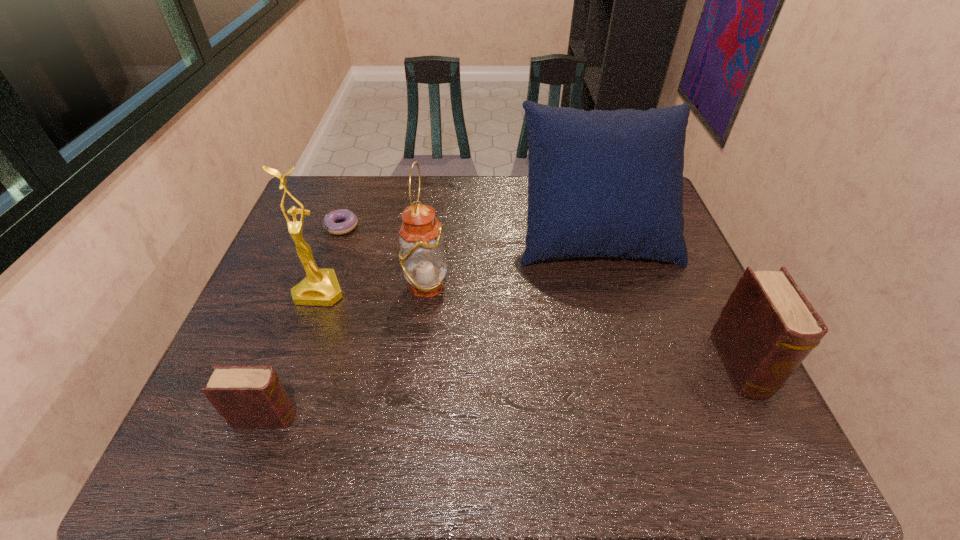
Find the location of a particular element. vacant area that lies between the left diary and the fifth farthest object is located at coordinates (504, 392).

Locate an element on the screen. The height and width of the screenshot is (540, 960). free spot between the shortest object and the shorter diary is located at coordinates (x=304, y=322).

Find the location of a particular element. This screenshot has width=960, height=540. free space between the oil lamp and the shortest object is located at coordinates [384, 255].

Where is `vacant space that's between the nearest object and the third shortest object`? The image size is (960, 540). vacant space that's between the nearest object and the third shortest object is located at coordinates (504, 392).

Locate an element on the screen. blank region between the cushion and the farther diary is located at coordinates (668, 299).

The height and width of the screenshot is (540, 960). Find the location of `vacant space that is in between the second nearest object and the shortest object`. vacant space that is in between the second nearest object and the shortest object is located at coordinates (541, 296).

Locate an element on the screen. free spot between the award and the fourth object from left to right is located at coordinates (373, 287).

At what (x,y) coordinates should I click in order to perform the action: click on free space between the cushion and the award. Please return your answer as a coordinate pair (x, y). The height and width of the screenshot is (540, 960). Looking at the image, I should click on (458, 261).

Locate an element on the screen. This screenshot has height=540, width=960. free spot between the cushion and the shortest object is located at coordinates (468, 230).

Identify the location of the second closest object to the cushion. Image resolution: width=960 pixels, height=540 pixels. (767, 328).